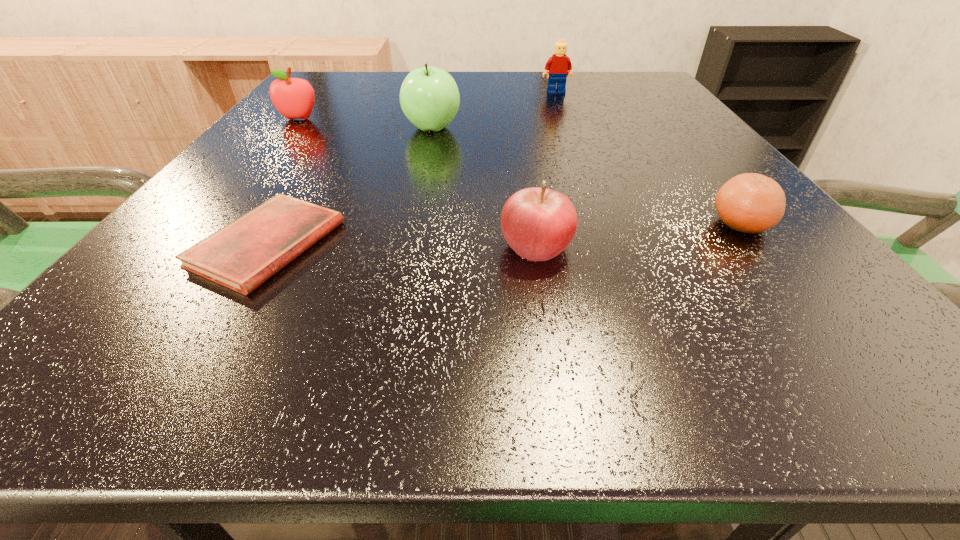
I want to click on free spot between the Lego and the shortest object, so click(412, 168).

Image resolution: width=960 pixels, height=540 pixels. In order to click on free space between the shortest object and the Lego in this screenshot , I will do `click(412, 168)`.

Locate an element on the screen. object that is the fourth nearest to the diary is located at coordinates (752, 203).

Find the location of a particular element. Image resolution: width=960 pixels, height=540 pixels. the second closest object to the diary is located at coordinates (429, 97).

Locate an element on the screen. The image size is (960, 540). apple that is the third nearest to the Lego is located at coordinates (538, 223).

You are a GUI agent. You are given a task and a screenshot of the screen. Output one action in this format:
    pyautogui.click(x=<x>, y=<y>)
    Task: Click on the second closest apple relative to the leftmost apple
    The width and height of the screenshot is (960, 540).
    Given the screenshot: What is the action you would take?
    pyautogui.click(x=538, y=223)

Find the location of a particular element. vacant position in the image that satisfies the following two spatial constraints: 1. on the back side of the shortest object; 2. on the left side of the third object from left to right is located at coordinates 338,128.

Find the location of a particular element. The width and height of the screenshot is (960, 540). free space that satisfies the following two spatial constraints: 1. on the front-facing side of the rightmost object; 2. on the left side of the second object from right to left is located at coordinates pos(607,224).